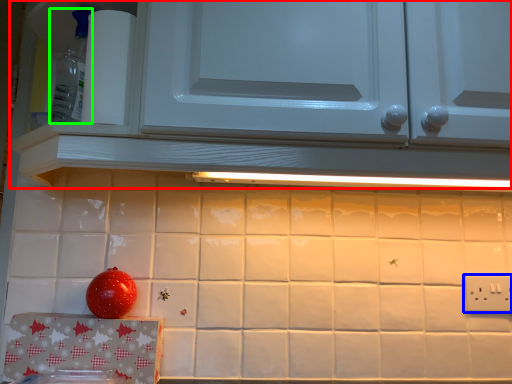
Question: Considering the real-world distances, which object is farthest from cabinetry (highlighted by a red box)? electric outlet (highlighted by a blue box) or appliance (highlighted by a green box)?

Choices:
 (A) electric outlet
 (B) appliance

Answer: (A)